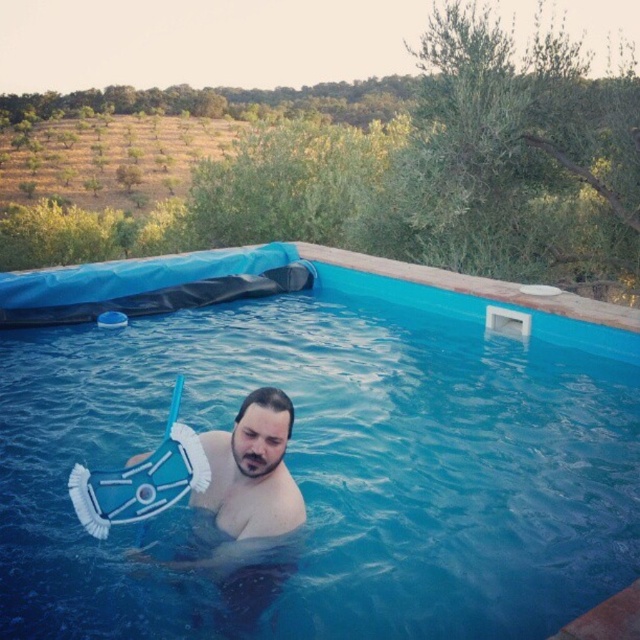
Question: Can you confirm if blue plastic pool at center is thinner than blue plastic snorkel at center?

Choices:
 (A) yes
 (B) no

Answer: (A)

Question: Among these points, which one is nearest to the camera?

Choices:
 (A) (225, 611)
 (B) (285, 244)

Answer: (A)

Question: From the image, what is the correct spatial relationship of blue plastic pool at center in relation to blue plastic snorkel at center?

Choices:
 (A) right
 (B) left

Answer: (A)

Question: Is blue plastic pool at center further to the viewer compared to blue plastic snorkel at center?

Choices:
 (A) no
 (B) yes

Answer: (B)